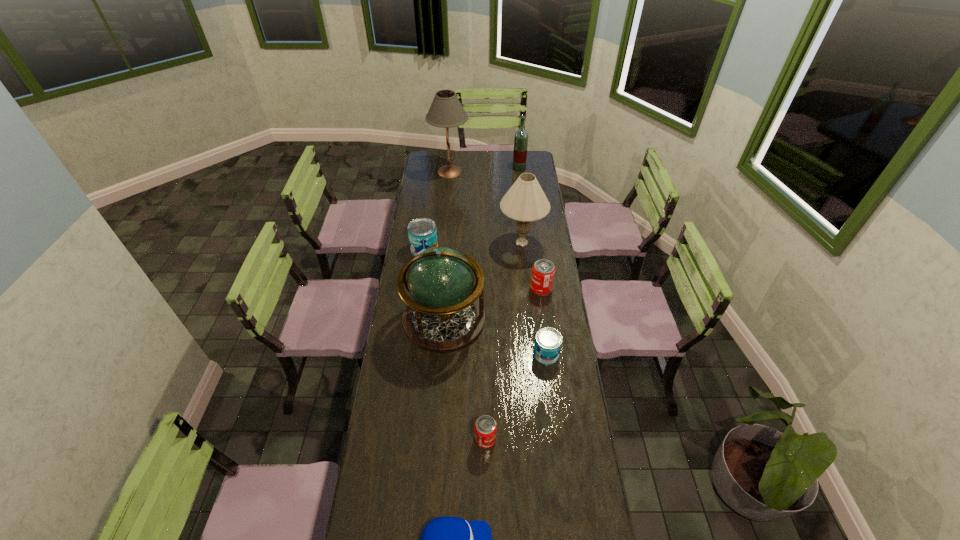
Select which object appears as the fifth closest to the nearer red can. Please provide its 2D coordinates. Your answer should be formatted as a tuple, i.e. [(x, y)], where the tuple contains the x and y coordinates of a point satisfying the conditions above.

[(525, 201)]

Locate which object ranks eighth in proximity to the beige lampshade. Please provide its 2D coordinates. Your answer should be formatted as a tuple, i.e. [(x, y)], where the tuple contains the x and y coordinates of a point satisfying the conditions above.

[(446, 539)]

Locate an element on the screen. Image resolution: width=960 pixels, height=540 pixels. can that is the second closest to the lampshade is located at coordinates (422, 232).

Select which can is the third closest to the nearest object. Please provide its 2D coordinates. Your answer should be formatted as a tuple, i.e. [(x, y)], where the tuple contains the x and y coordinates of a point satisfying the conditions above.

[(543, 271)]

At what (x,y) coordinates should I click in order to perform the action: click on vacant space that satisfies the following two spatial constraints: 1. on the front side of the left red can; 2. on the left side of the farther blue can. Please return your answer as a coordinate pair (x, y). This screenshot has height=540, width=960. Looking at the image, I should click on (400, 439).